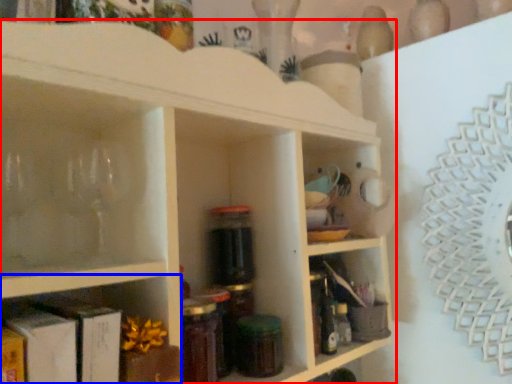
Question: Among these objects, which one is farthest to the camera, shelf (highlighted by a red box) or shelf (highlighted by a blue box)?

Choices:
 (A) shelf
 (B) shelf

Answer: (A)